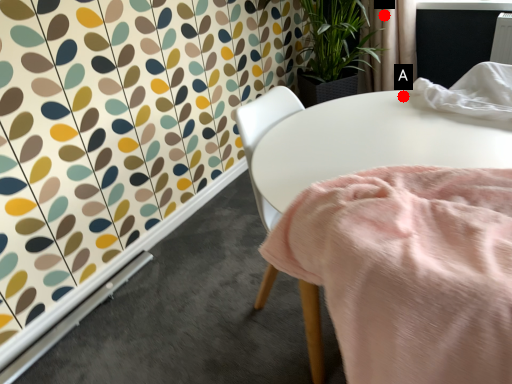
Question: Two points are circled on the image, labeled by A and B beside each circle. Which point is closer to the camera?

Choices:
 (A) A is closer
 (B) B is closer

Answer: (A)